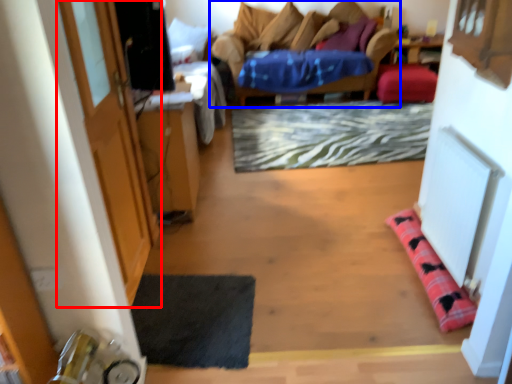
Question: Among these objects, which one is nearest to the camera, door (highlighted by a red box) or furniture (highlighted by a blue box)?

Choices:
 (A) door
 (B) furniture

Answer: (A)